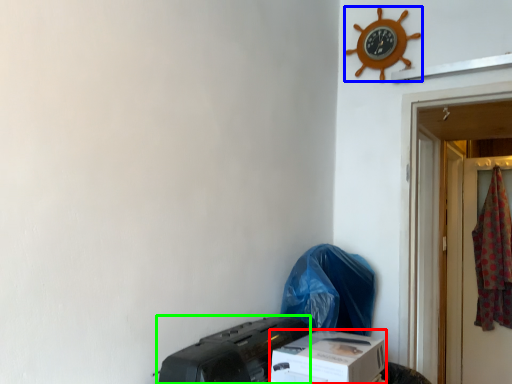
Question: Considering the real-world distances, which object is closest to box (highlighted by a red box)? clock (highlighted by a blue box) or printer (highlighted by a green box).

Choices:
 (A) clock
 (B) printer

Answer: (B)